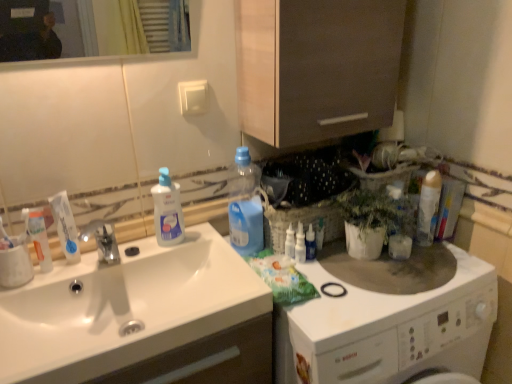
I want to click on vacant area located to the right-hand side of clear plastic bottle at sink, which appears as the first cleaning product when viewed from the left, so click(214, 247).